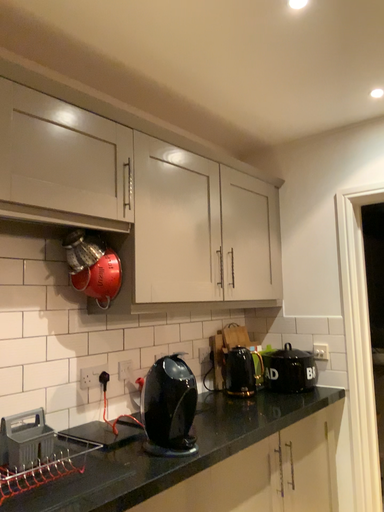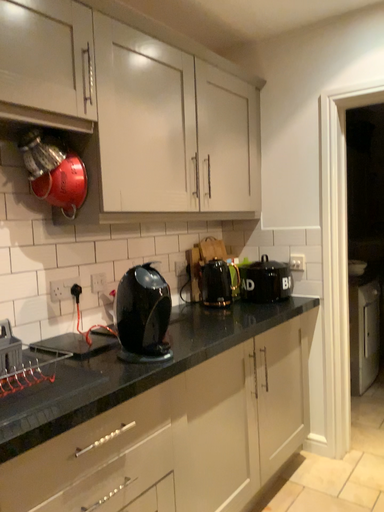
Question: Which way did the camera rotate in the video?

Choices:
 (A) rotated downward
 (B) rotated upward

Answer: (A)